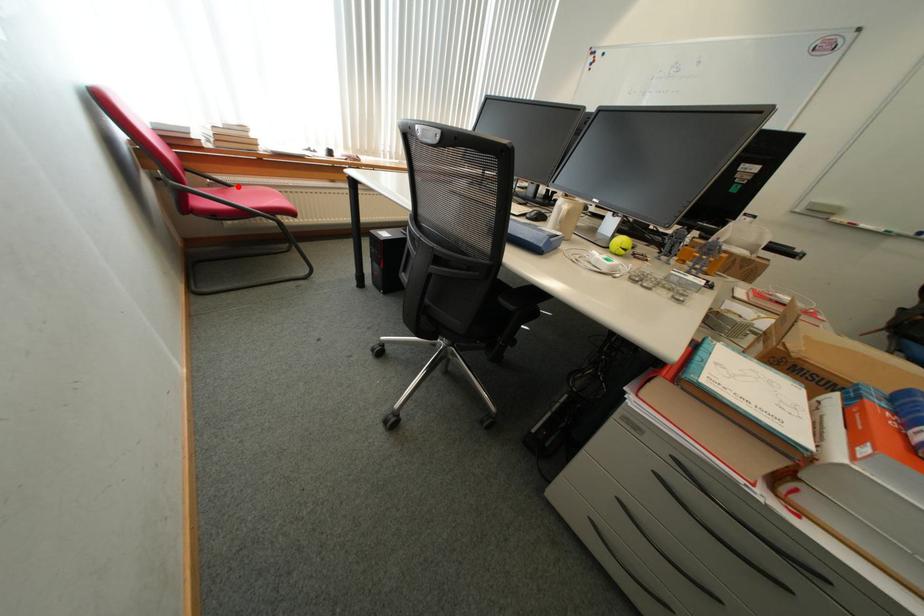
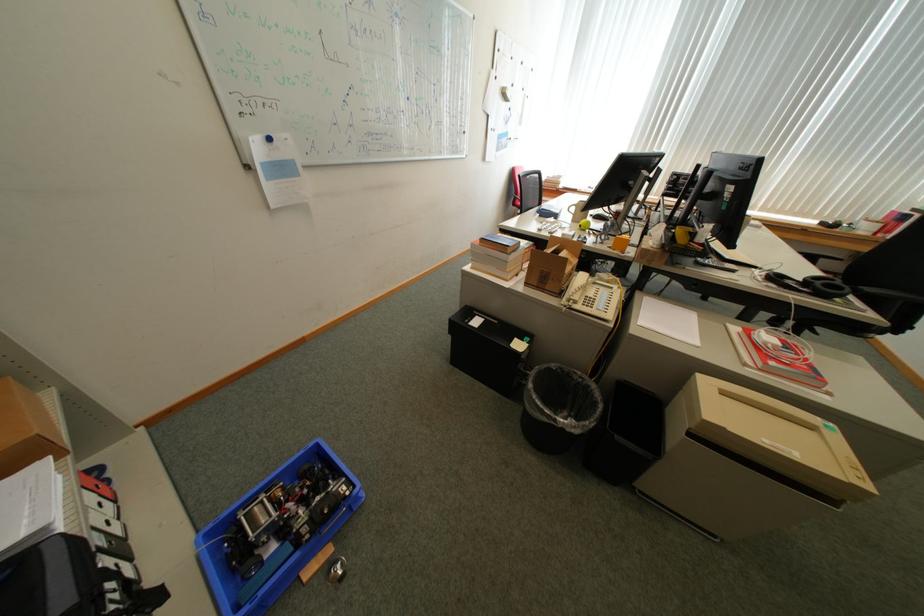
Question: I am providing you with two images of the same scene from different viewpoints. A red point is marked on the first image. Is the red point's position out of view in image 2?

Choices:
 (A) Yes
 (B) No

Answer: (A)